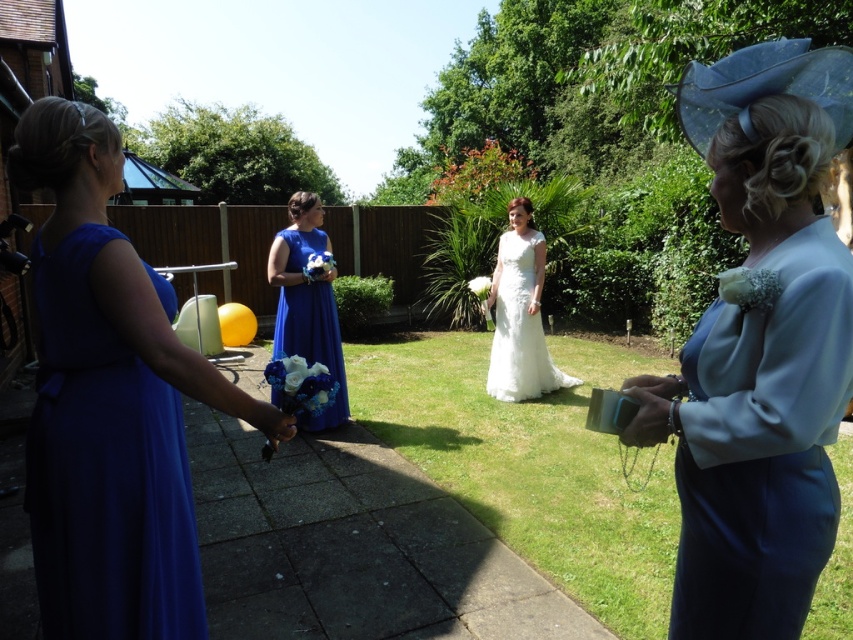
Question: Estimate the real-world distances between objects in this image. Which object is farther from the white lace dress at center?

Choices:
 (A) royal blue satin dress at left
 (B) light blue satin dress at right
 (C) royal blue dress at left
 (D) royal blue satin dress at center

Answer: (A)

Question: Does royal blue satin dress at left have a greater width compared to white lace dress at center?

Choices:
 (A) yes
 (B) no

Answer: (B)

Question: Which point is closer to the camera?

Choices:
 (A) pyautogui.click(x=91, y=180)
 (B) pyautogui.click(x=165, y=307)
 (C) pyautogui.click(x=799, y=84)

Answer: (C)

Question: Which object is positioned farthest from the royal blue dress at left?

Choices:
 (A) light blue satin dress at right
 (B) royal blue satin dress at left
 (C) white lace dress at center
 (D) royal blue satin dress at center

Answer: (C)

Question: Does white lace dress at center have a larger size compared to royal blue satin dress at center?

Choices:
 (A) yes
 (B) no

Answer: (A)

Question: Does white lace dress at center appear over royal blue satin dress at center?

Choices:
 (A) no
 (B) yes

Answer: (B)